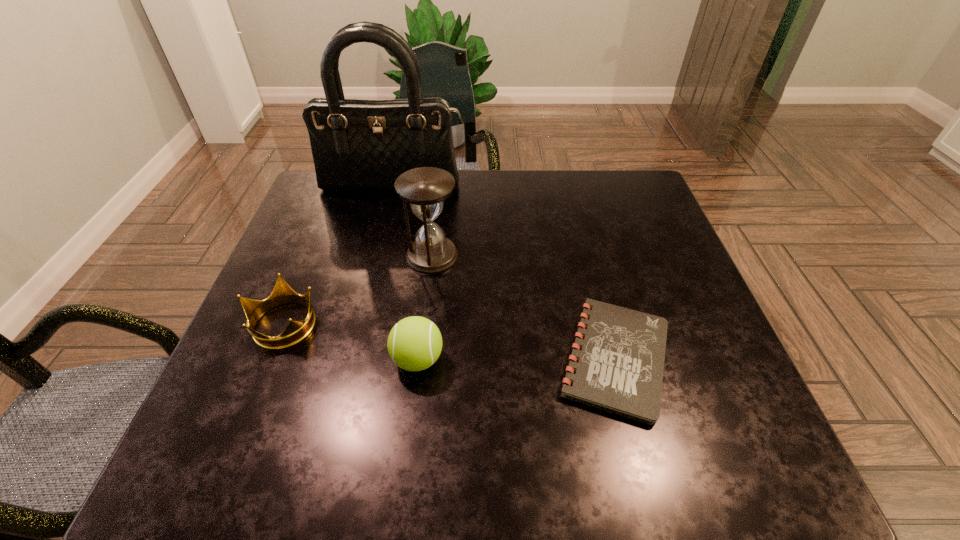
Identify the location of free location located 0.240m on the left of the third shortest object. Image resolution: width=960 pixels, height=540 pixels. (268, 359).

The height and width of the screenshot is (540, 960). Find the location of `vacant area situated 0.230m on the right of the crown`. vacant area situated 0.230m on the right of the crown is located at coordinates (427, 323).

In order to click on vacant space located 0.310m on the left of the notebook in this screenshot , I will do `click(395, 359)`.

You are a GUI agent. You are given a task and a screenshot of the screen. Output one action in this format:
    pyautogui.click(x=<x>, y=<y>)
    Task: Click on the object located in the far edge section of the desktop
    Image resolution: width=960 pixels, height=540 pixels.
    Given the screenshot: What is the action you would take?
    pyautogui.click(x=357, y=145)

You are a GUI agent. You are given a task and a screenshot of the screen. Output one action in this format:
    pyautogui.click(x=<x>, y=<y>)
    Task: Click on the handbag that is positioned at the left edge
    The width and height of the screenshot is (960, 540).
    Given the screenshot: What is the action you would take?
    pyautogui.click(x=357, y=145)

At what (x,y) coordinates should I click in order to perform the action: click on crown that is at the left edge. Please return your answer as a coordinate pair (x, y). This screenshot has height=540, width=960. Looking at the image, I should click on (296, 331).

Identify the location of object that is positioned at the right edge. (617, 363).

Where is `object situated at the far left corner`? object situated at the far left corner is located at coordinates (357, 145).

Locate an element on the screen. This screenshot has width=960, height=540. vacant area at the far edge of the desktop is located at coordinates (383, 192).

This screenshot has width=960, height=540. What are the coordinates of `vacant space at the near edge of the desktop` in the screenshot? It's located at (498, 457).